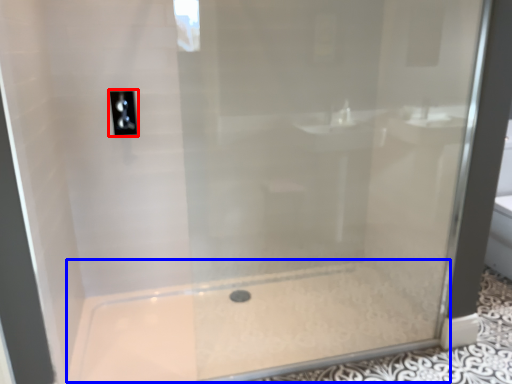
Question: Which of the following is the closest to the observer, light switch (highlighted by a red box) or bath (highlighted by a blue box)?

Choices:
 (A) light switch
 (B) bath

Answer: (B)